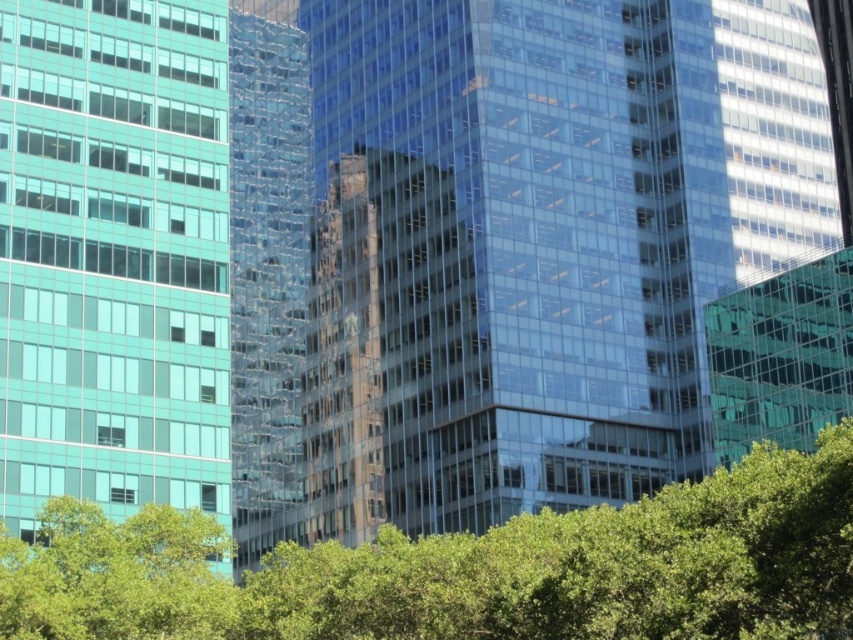
From the picture: You are a drone operator who needs to fly a drone from the transparent glass building at center to the teal glass building at left. Given that your drone has a maximum flight range of 100 feet, can it safely make the trip without needing to recharge?

The distance between the transparent glass building at center and the teal glass building at left is 86.59 feet, which is within the drone operator drone operator maximum flight range of 100 feet. Yes, the drone can safely make the trip without needing to recharge.

You are standing in the urban park adjacent to the teal glass building at left. You want to take a photo of the building from a distance that is exactly 60 meters away. Is this possible?

The distance between the teal glass building at left and the viewer is 60.74 meters, so you can move slightly closer to achieve the desired 60 meters distance for your photo.